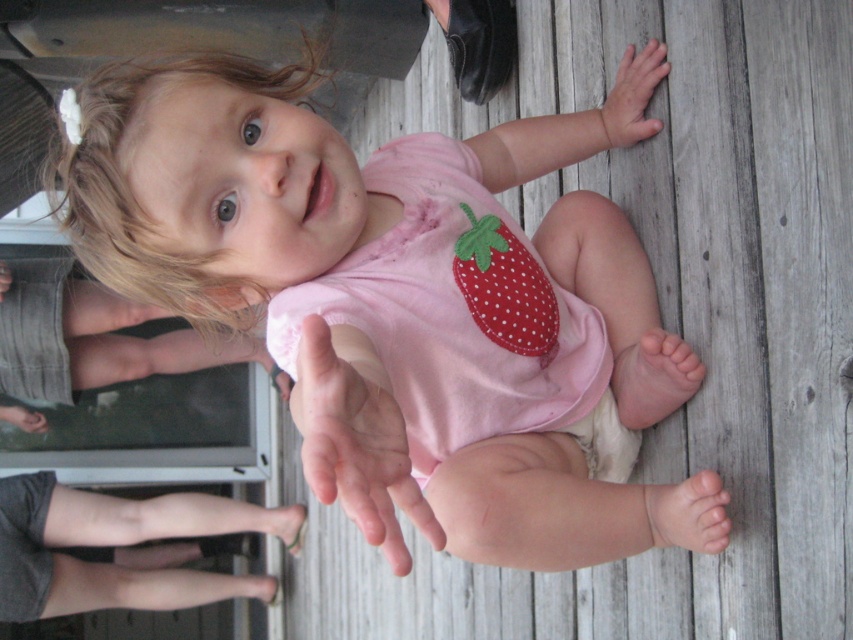
Question: From the image, what is the correct spatial relationship of pink fabric bib at center in relation to pink smooth hand at center?

Choices:
 (A) left
 (B) right

Answer: (B)

Question: Can you confirm if pink fabric diaper at lower left is smaller than smooth wooden hand at upper right?

Choices:
 (A) yes
 (B) no

Answer: (B)

Question: Which of the following is the farthest from the observer?

Choices:
 (A) (585, 342)
 (B) (21, 424)
 (C) (608, 451)
 (D) (451, 276)

Answer: (B)

Question: Among these points, which one is farthest from the camera?

Choices:
 (A) (610, 108)
 (B) (334, 240)
 (C) (520, 314)

Answer: (A)

Question: Is pink smooth hand at center thinner than white cloth diaper at lower center?

Choices:
 (A) yes
 (B) no

Answer: (B)

Question: Which of the following is the closest to the observer?

Choices:
 (A) (486, 316)
 (B) (614, 465)
 (C) (38, 420)
 (D) (612, 93)

Answer: (A)